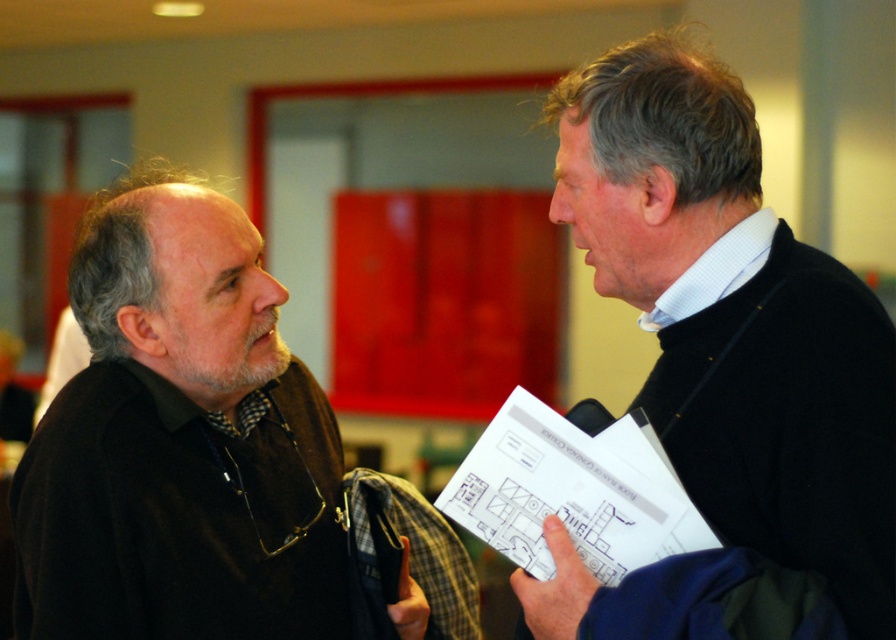
Question: Does black matte shirt at left have a smaller size compared to white paper at center?

Choices:
 (A) yes
 (B) no

Answer: (B)

Question: Which of these objects is positioned closest to the black sweater at right?

Choices:
 (A) white paper at center
 (B) black matte shirt at left

Answer: (A)

Question: Which is farther from the black matte shirt at left?

Choices:
 (A) black sweater at right
 (B) white paper at center

Answer: (A)

Question: Which point is closer to the camera taking this photo?

Choices:
 (A) (592, 497)
 (B) (147, 280)
 (C) (774, 369)

Answer: (C)

Question: Is black sweater at right further to the viewer compared to white paper at center?

Choices:
 (A) yes
 (B) no

Answer: (B)

Question: Does black matte shirt at left appear on the right side of black sweater at right?

Choices:
 (A) no
 (B) yes

Answer: (A)